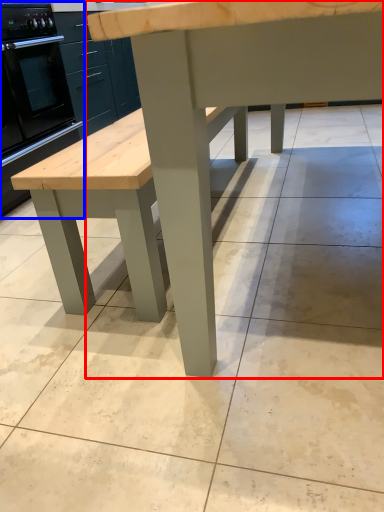
Question: Which point is further to the camera, table (highlighted by a red box) or oven (highlighted by a blue box)?

Choices:
 (A) table
 (B) oven

Answer: (B)